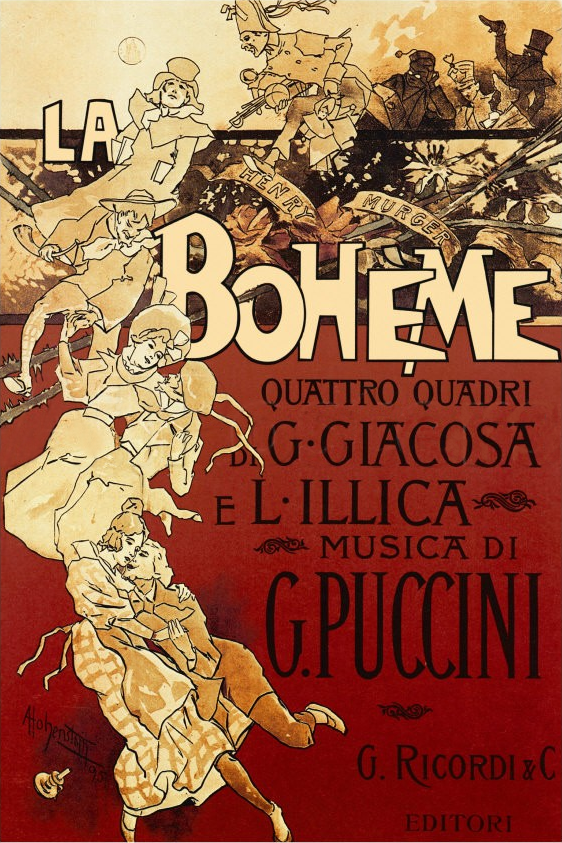
The image size is (562, 843). What are the coordinates of `cover` in the screenshot? It's located at 493,715.